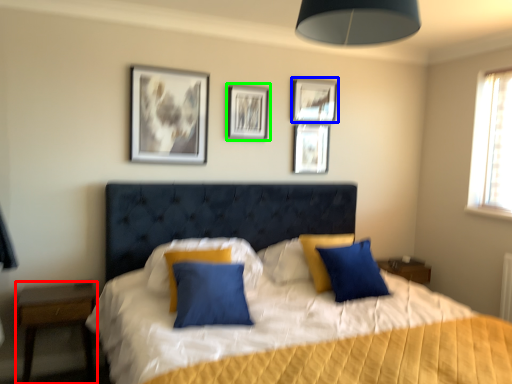
Question: Estimate the real-world distances between objects in this image. Which object is closer to nightstand (highlighted by a red box), picture frame (highlighted by a blue box) or picture frame (highlighted by a green box)?

Choices:
 (A) picture frame
 (B) picture frame

Answer: (B)